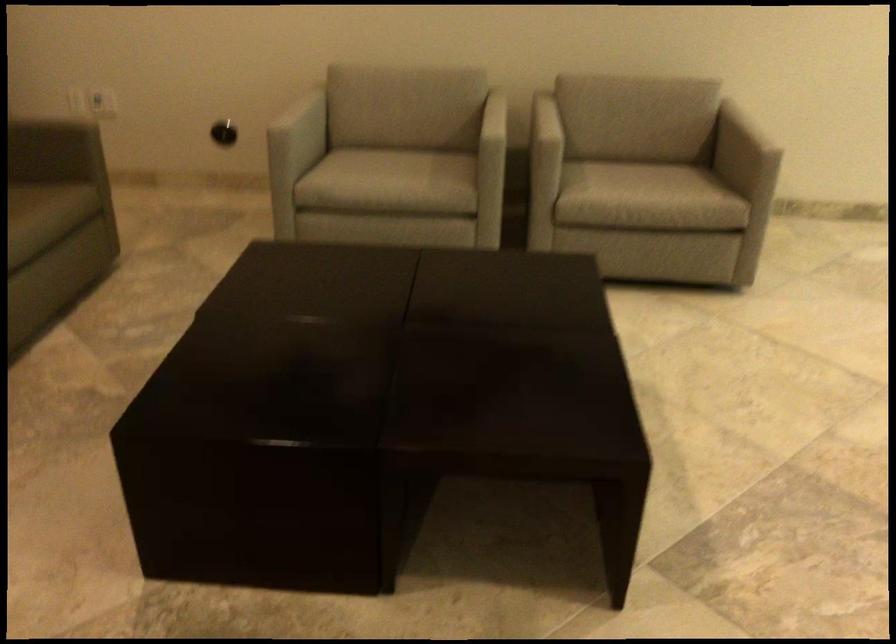
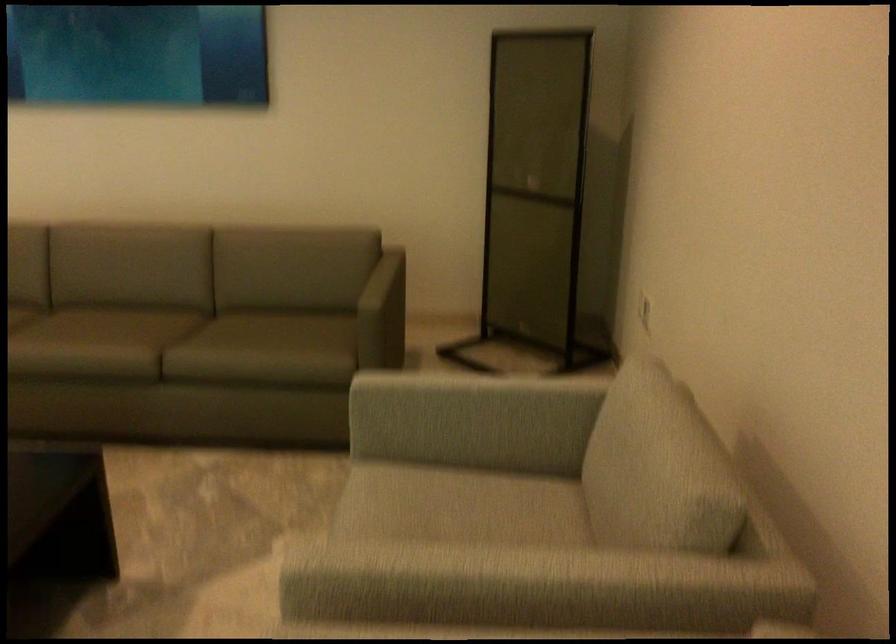
The point at (297, 109) is marked in the first image. Where is the corresponding point in the second image?

(469, 399)